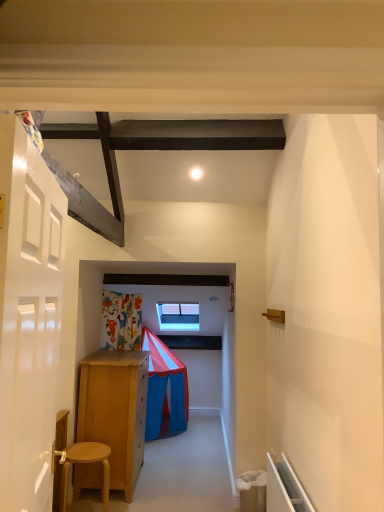
Locate an element on the screen. white glossy door at left is located at coordinates (28, 319).

Describe the element at coordinates (28, 319) in the screenshot. I see `white glossy door at left` at that location.

This screenshot has width=384, height=512. Describe the element at coordinates (84, 463) in the screenshot. I see `light brown wooden stool at lower left` at that location.

Measure the distance between point [89,448] and camera.

Point [89,448] and camera are 3.14 meters apart from each other.

At what (x,y) coordinates should I click in order to perform the action: click on light brown wooden stool at lower left. Please return your answer as a coordinate pair (x, y). The height and width of the screenshot is (512, 384). Looking at the image, I should click on (84, 463).

Find the location of a particular element. white glossy door at left is located at coordinates click(x=28, y=319).

Which object is positioned more to the right, white glossy door at left or light brown wooden stool at lower left?

From the viewer's perspective, white glossy door at left appears more on the right side.

Which object is closer to the camera, white glossy door at left or light brown wooden stool at lower left?

Positioned in front is white glossy door at left.

Is point (26, 239) closer to camera compared to point (101, 460)?

Yes, point (26, 239) is in front of point (101, 460).

In the scene shown: From the image's perspective, between white glossy door at left and light brown wooden stool at lower left, which one is located above?

white glossy door at left appears higher in the image.

Based on the photo, from a real-world perspective, is white glossy door at left located beneath light brown wooden stool at lower left?

No, from a real-world perspective, white glossy door at left is not under light brown wooden stool at lower left.

Looking at their sizes, would you say white glossy door at left is wider or thinner than light brown wooden stool at lower left?

white glossy door at left is thinner than light brown wooden stool at lower left.

Considering the sizes of white glossy door at left and light brown wooden stool at lower left in the image, is white glossy door at left taller or shorter than light brown wooden stool at lower left?

Considering their sizes, white glossy door at left has more height than light brown wooden stool at lower left.

Who is smaller, white glossy door at left or light brown wooden stool at lower left?

light brown wooden stool at lower left.

Would you say white glossy door at left is outside light brown wooden stool at lower left?

Yes, white glossy door at left is located beyond the bounds of light brown wooden stool at lower left.

Is white glossy door at left next to light brown wooden stool at lower left?

No, white glossy door at left is not beside light brown wooden stool at lower left.

Is white glossy door at left oriented away from light brown wooden stool at lower left?

No.

What's the angular difference between white glossy door at left and light brown wooden stool at lower left's facing directions?

The angular difference between white glossy door at left and light brown wooden stool at lower left is 87.9 degrees.

This screenshot has width=384, height=512. Identify the location of door on the right of light brown wooden stool at lower left. (28, 319).

Is light brown wooden stool at lower left at the left side of white glossy door at left?

Yes.

Looking at this image, considering their positions, is light brown wooden stool at lower left located in front of or behind white glossy door at left?

light brown wooden stool at lower left is behind white glossy door at left.

Does point (105, 466) lie in front of point (4, 310)?

No, (105, 466) is further to viewer.

From the image's perspective, is light brown wooden stool at lower left above white glossy door at left?

No.

From a real-world perspective, is light brown wooden stool at lower left beneath white glossy door at left?

Yes, from a real-world perspective, light brown wooden stool at lower left is beneath white glossy door at left.

Between light brown wooden stool at lower left and white glossy door at left, which one has larger width?

With larger width is light brown wooden stool at lower left.

Who is shorter, light brown wooden stool at lower left or white glossy door at left?

light brown wooden stool at lower left.

Considering the sizes of objects light brown wooden stool at lower left and white glossy door at left in the image provided, who is smaller, light brown wooden stool at lower left or white glossy door at left?

Smaller between the two is light brown wooden stool at lower left.

Is light brown wooden stool at lower left inside or outside of white glossy door at left?

light brown wooden stool at lower left exists outside the volume of white glossy door at left.

Does light brown wooden stool at lower left touch white glossy door at left?

There is a gap between light brown wooden stool at lower left and white glossy door at left.

Is light brown wooden stool at lower left aimed at white glossy door at left?

No, light brown wooden stool at lower left is not facing towards white glossy door at left.

How distant is light brown wooden stool at lower left from white glossy door at left?

The distance of light brown wooden stool at lower left from white glossy door at left is 6.17 feet.

This screenshot has width=384, height=512. What are the coordinates of `door in front of the light brown wooden stool at lower left` in the screenshot? It's located at (28, 319).

The height and width of the screenshot is (512, 384). Find the location of `door that is on the right side of light brown wooden stool at lower left`. door that is on the right side of light brown wooden stool at lower left is located at coordinates pyautogui.click(x=28, y=319).

This screenshot has width=384, height=512. I want to click on stool located on the left of white glossy door at left, so 84,463.